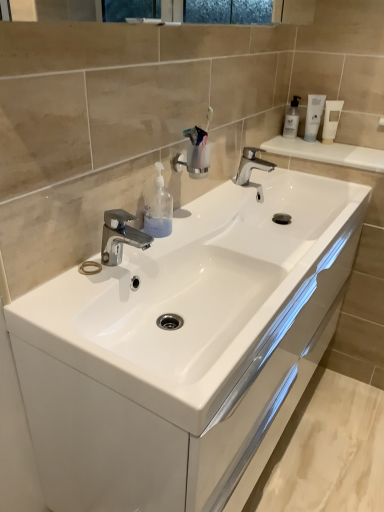
This screenshot has height=512, width=384. What are the coordinates of `vacant space to the left of polished chrome faucet at center, which is the first tap from left to right` in the screenshot? It's located at (69, 279).